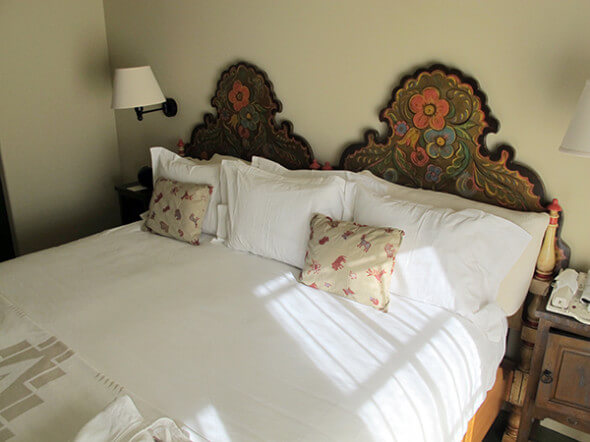
Identify the location of space under the table. (557, 427).